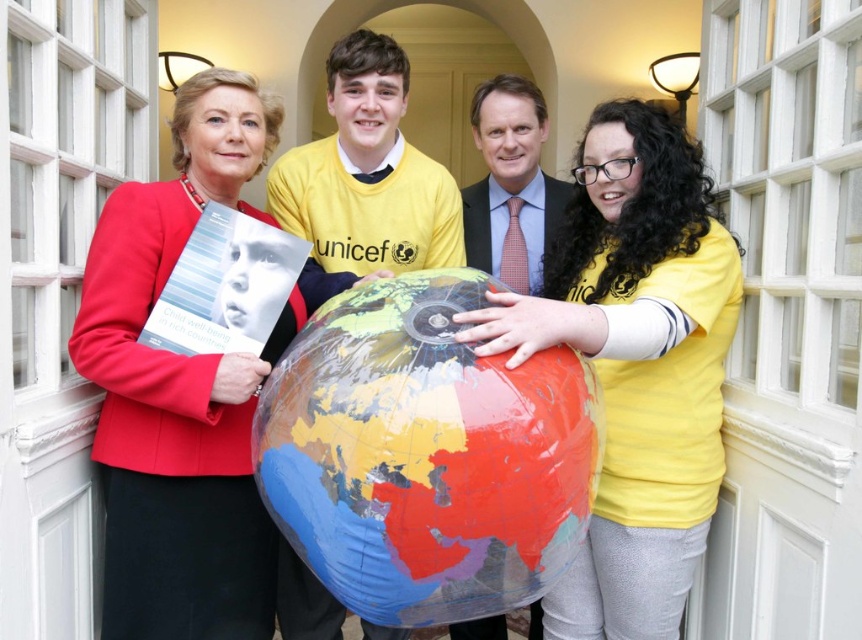
Looking at this image, who is positioned more to the left, smooth suit at center or matte black suit at center?

matte black suit at center is more to the left.

The width and height of the screenshot is (862, 640). Describe the element at coordinates (510, 184) in the screenshot. I see `smooth suit at center` at that location.

The width and height of the screenshot is (862, 640). Describe the element at coordinates (510, 184) in the screenshot. I see `smooth suit at center` at that location.

Where is `smooth suit at center`? The width and height of the screenshot is (862, 640). smooth suit at center is located at coordinates (510, 184).

Which of these two, matte red blazer at left or smooth suit at center, stands shorter?

Standing shorter between the two is smooth suit at center.

Can you confirm if matte red blazer at left is bigger than smooth suit at center?

Yes, matte red blazer at left is bigger than smooth suit at center.

Between point (170, 500) and point (526, 173), which one is positioned in front?

Point (170, 500) is in front.

Find the location of a particular element. Image resolution: width=862 pixels, height=640 pixels. matte red blazer at left is located at coordinates (180, 392).

Is translucent plastic globe at center wider than yellow fabric shirt at center?

Yes.

Which is behind, point (426, 353) or point (382, 634)?

Positioned behind is point (382, 634).

Who is more forward, (431,609) or (332,621)?

Positioned in front is point (431,609).

Identify the location of translucent plastic globe at center. (x=423, y=456).